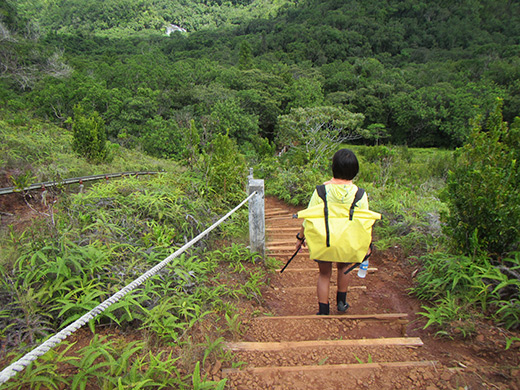
Locate an element on the screen. brown stairsteps is located at coordinates (324, 372), (327, 353), (291, 326), (286, 295), (296, 259).